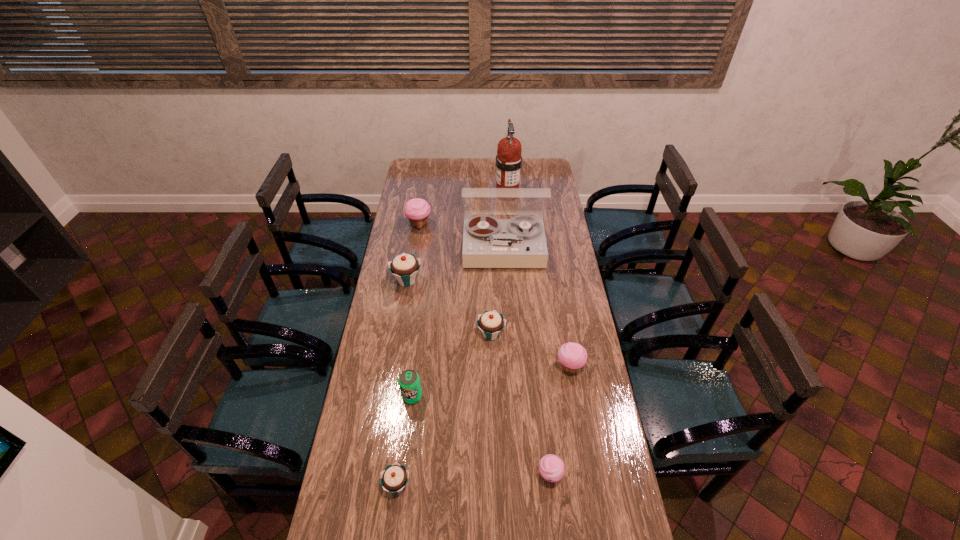
The height and width of the screenshot is (540, 960). In the image, there is a desktop. What are the coordinates of `vacant space at the right edge` in the screenshot? It's located at (549, 258).

Where is `blank space at the far right corner of the desktop`? This screenshot has height=540, width=960. blank space at the far right corner of the desktop is located at coordinates (547, 176).

Where is `unoccupied position between the sixth farthest object and the second biggest teal cupcake`? This screenshot has width=960, height=540. unoccupied position between the sixth farthest object and the second biggest teal cupcake is located at coordinates (530, 350).

Locate an element on the screen. The image size is (960, 540). free space between the second biggest teal cupcake and the second pink cupcake from left to right is located at coordinates (520, 405).

At what (x,y) coordinates should I click in order to perform the action: click on vacant area that lies between the biggest teal cupcake and the nearest pink cupcake. Please return your answer as a coordinate pair (x, y). This screenshot has width=960, height=540. Looking at the image, I should click on (478, 378).

Find the location of a particular element. The width and height of the screenshot is (960, 540). vacant space that's between the nearest pink cupcake and the red fire extinguisher is located at coordinates (528, 335).

Find the location of a particular element. free space between the second tallest object and the rightmost cupcake is located at coordinates (537, 308).

Find the location of a particular element. vacant region between the white record player and the second biggest teal cupcake is located at coordinates (497, 291).

In order to click on free space that is in between the farthest cupcake and the nearest pink cupcake in this screenshot , I will do `click(485, 350)`.

The image size is (960, 540). What are the coordinates of `the third closest object to the biggest teal cupcake` in the screenshot? It's located at (491, 323).